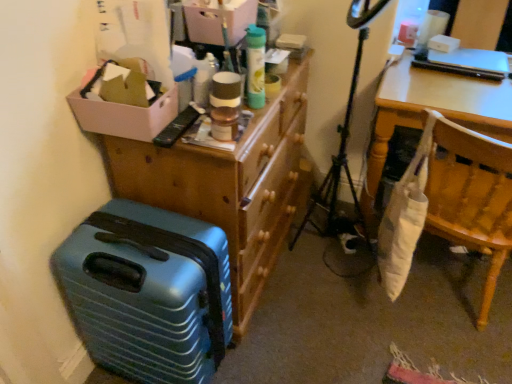
Question: Is teal matte suitcase at lower left oriented away from white cardboard box at upper left?

Choices:
 (A) no
 (B) yes

Answer: (A)

Question: Is teal matte suitcase at lower left to the right of white cardboard box at upper left from the viewer's perspective?

Choices:
 (A) no
 (B) yes

Answer: (B)

Question: Does teal matte suitcase at lower left have a lesser width compared to white cardboard box at upper left?

Choices:
 (A) yes
 (B) no

Answer: (B)

Question: From a real-world perspective, is teal matte suitcase at lower left located beneath white cardboard box at upper left?

Choices:
 (A) no
 (B) yes

Answer: (B)

Question: Considering the relative sizes of teal matte suitcase at lower left and white cardboard box at upper left in the image provided, is teal matte suitcase at lower left wider than white cardboard box at upper left?

Choices:
 (A) no
 (B) yes

Answer: (B)

Question: Is there a large distance between teal matte suitcase at lower left and white cardboard box at upper left?

Choices:
 (A) no
 (B) yes

Answer: (A)

Question: Does white fabric bag at right appear on the right side of teal matte suitcase at lower left?

Choices:
 (A) yes
 (B) no

Answer: (A)

Question: From a real-world perspective, is white fabric bag at right over teal matte suitcase at lower left?

Choices:
 (A) no
 (B) yes

Answer: (B)

Question: Considering the relative sizes of white fabric bag at right and teal matte suitcase at lower left in the image provided, is white fabric bag at right thinner than teal matte suitcase at lower left?

Choices:
 (A) yes
 (B) no

Answer: (B)

Question: Considering the relative sizes of white fabric bag at right and teal matte suitcase at lower left in the image provided, is white fabric bag at right taller than teal matte suitcase at lower left?

Choices:
 (A) no
 (B) yes

Answer: (B)

Question: From the image's perspective, is white fabric bag at right on top of teal matte suitcase at lower left?

Choices:
 (A) no
 (B) yes

Answer: (B)

Question: Is white fabric bag at right aimed at teal matte suitcase at lower left?

Choices:
 (A) no
 (B) yes

Answer: (A)

Question: From a real-world perspective, is wooden dresser at upper center on top of matte cardboard box at upper center?

Choices:
 (A) yes
 (B) no

Answer: (B)